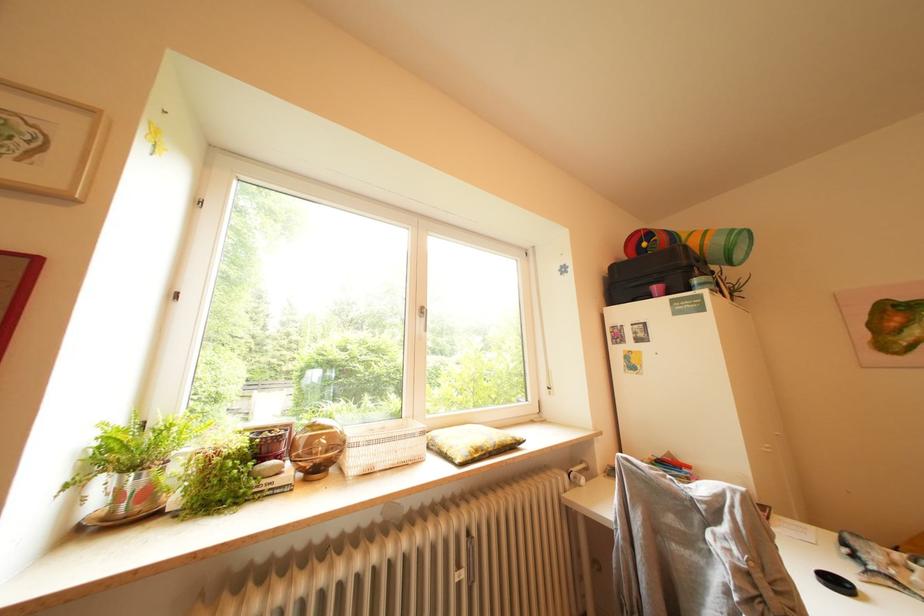
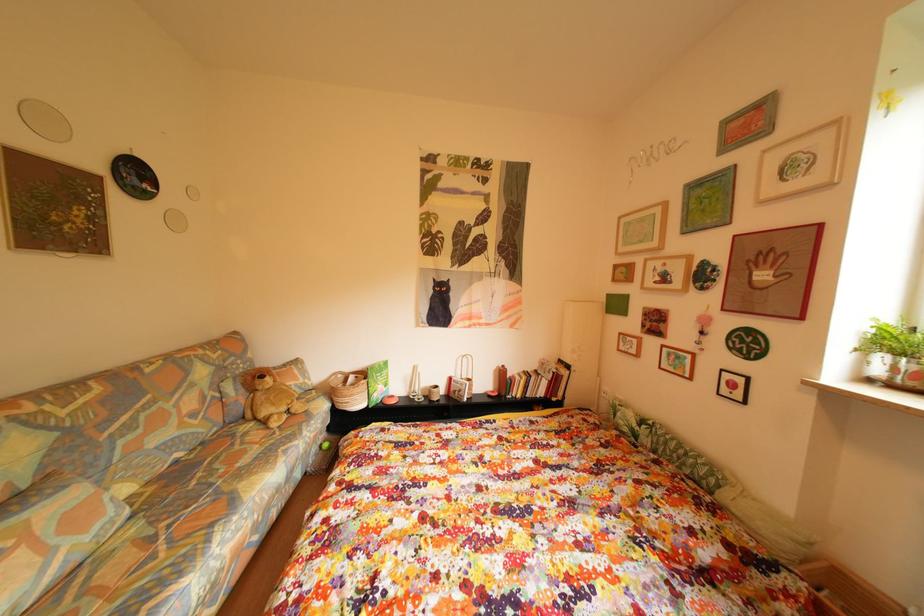
Question: The camera is either moving clockwise (left) or counter-clockwise (right) around the object. The first image is from the beginning of the video and the second image is from the end. Is the camera moving left or right when shooting the video?

Choices:
 (A) Left
 (B) Right

Answer: (B)